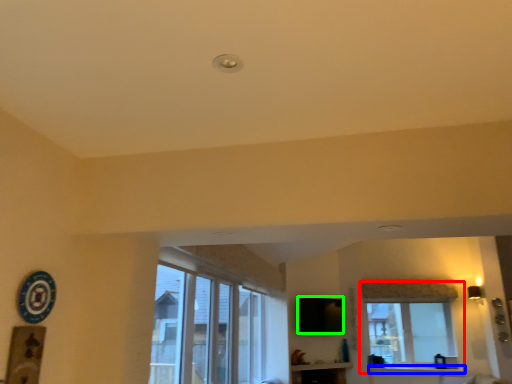
Question: Based on their relative distances, which object is farther from window (highlighted by a red box)? Choose from window sill (highlighted by a blue box) and window screen (highlighted by a green box).

Choices:
 (A) window sill
 (B) window screen

Answer: (B)